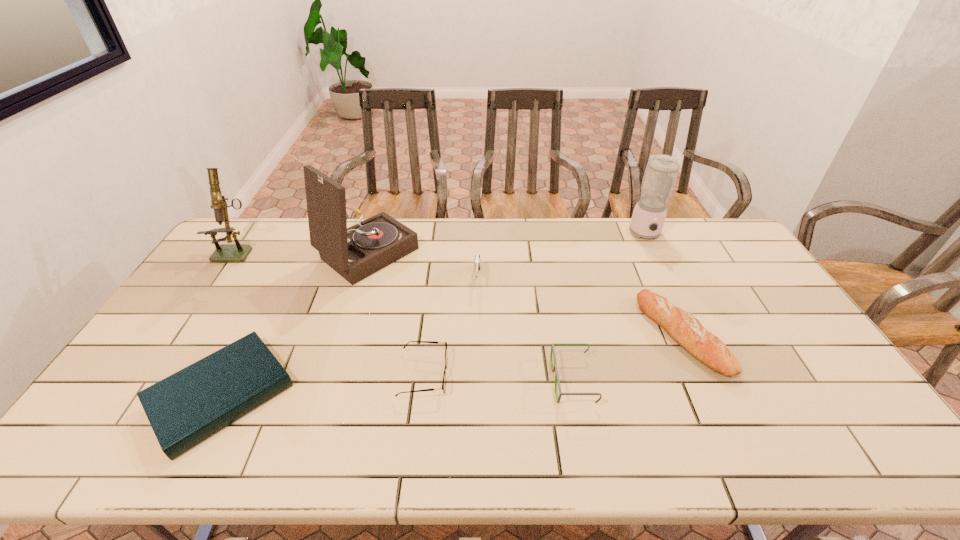
Where is `blank space at the right edge of the desktop`? blank space at the right edge of the desktop is located at coordinates (x=817, y=399).

I want to click on vacant position at the far left corner of the desktop, so click(x=268, y=226).

Identify the location of free point between the left spectacles and the microscope. The image size is (960, 540). (331, 313).

Find the location of a particular element. This screenshot has height=540, width=960. free space between the book and the left spectacles is located at coordinates (323, 385).

Locate an element on the screen. free area in between the phonograph record and the food processor is located at coordinates (507, 244).

Where is `empty location between the fifth object from right to left and the right spectacles`? empty location between the fifth object from right to left and the right spectacles is located at coordinates (498, 378).

The width and height of the screenshot is (960, 540). I want to click on vacant space that's between the third object from right to left and the phonograph record, so click(470, 316).

The width and height of the screenshot is (960, 540). Identify the location of vacant area between the fifth shortest object and the food processor. (562, 257).

In order to click on free space between the fifth object from right to left and the book in this screenshot , I will do `click(323, 385)`.

Identify the location of vacant point located between the left spectacles and the food processor. This screenshot has height=540, width=960. (535, 305).